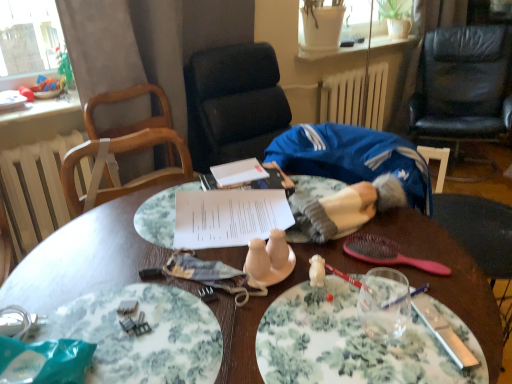
The height and width of the screenshot is (384, 512). I want to click on free location to the right of pink plastic spoon at lower right, so click(x=442, y=252).